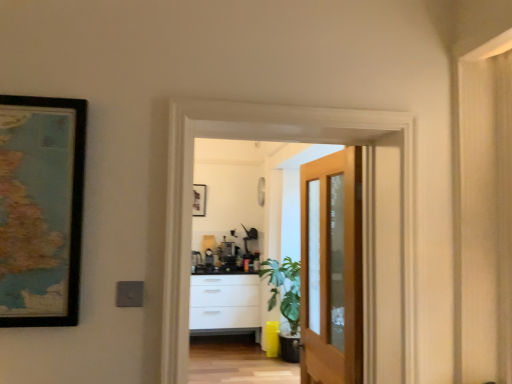
Question: Can you confirm if wooden screen door at center is smaller than light brown wooden door at center?

Choices:
 (A) yes
 (B) no

Answer: (B)

Question: Is wooden screen door at center in contact with light brown wooden door at center?

Choices:
 (A) no
 (B) yes

Answer: (A)

Question: From the image's perspective, would you say wooden screen door at center is shown under light brown wooden door at center?

Choices:
 (A) yes
 (B) no

Answer: (B)

Question: Considering the relative sizes of wooden screen door at center and light brown wooden door at center in the image provided, is wooden screen door at center wider than light brown wooden door at center?

Choices:
 (A) no
 (B) yes

Answer: (B)

Question: Considering the relative sizes of wooden screen door at center and light brown wooden door at center in the image provided, is wooden screen door at center shorter than light brown wooden door at center?

Choices:
 (A) yes
 (B) no

Answer: (A)

Question: Is wooden screen door at center in front of or behind wooden floor at lower center in the image?

Choices:
 (A) front
 (B) behind

Answer: (A)

Question: In terms of height, does wooden screen door at center look taller or shorter compared to wooden floor at lower center?

Choices:
 (A) short
 (B) tall

Answer: (B)

Question: Based on their sizes in the image, would you say wooden screen door at center is bigger or smaller than wooden floor at lower center?

Choices:
 (A) big
 (B) small

Answer: (A)

Question: From the image's perspective, is wooden screen door at center above or below wooden floor at lower center?

Choices:
 (A) below
 (B) above

Answer: (B)

Question: Does point (359, 334) appear closer or farther from the camera than point (82, 178)?

Choices:
 (A) closer
 (B) farther

Answer: (B)

Question: Considering the relative positions of light brown wooden door at center and wooden-framed map at left in the image provided, is light brown wooden door at center to the left or to the right of wooden-framed map at left?

Choices:
 (A) left
 (B) right

Answer: (B)

Question: Considering the positions of light brown wooden door at center and wooden-framed map at left in the image, is light brown wooden door at center wider or thinner than wooden-framed map at left?

Choices:
 (A) wide
 (B) thin

Answer: (A)

Question: Which is correct: light brown wooden door at center is inside wooden-framed map at left, or outside of it?

Choices:
 (A) outside
 (B) inside

Answer: (A)

Question: In terms of height, does wooden floor at lower center look taller or shorter compared to light brown wooden door at center?

Choices:
 (A) short
 (B) tall

Answer: (A)

Question: From the image's perspective, is wooden floor at lower center positioned above or below light brown wooden door at center?

Choices:
 (A) above
 (B) below

Answer: (B)